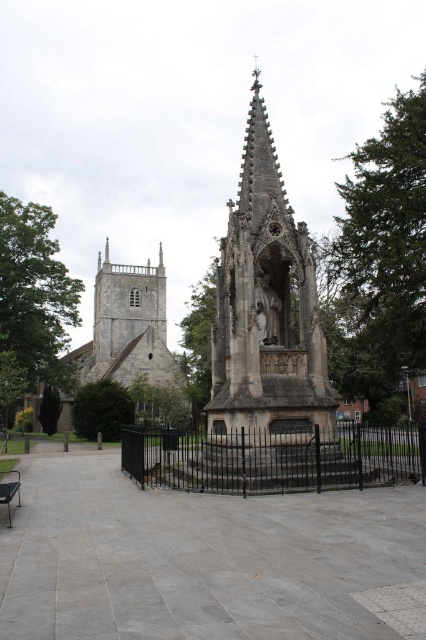
You are a visitor standing at the entrance of the churchyard and want to sit down to rest. You see the stone church at center and the black metal bench at lower left. Which object is larger and would provide a better reference for finding the bench?

The stone church at center is bigger than the black metal bench at lower left, so the stone church at center can be used as a larger reference point to locate the bench.

You are a visitor standing in front of the Gothic monument and want to rest. You see the black metal fence at center and the black metal bench at lower left. Which object is taller and can you sit on it?

The black metal fence at center is taller than the black metal bench at lower left. However, fences are typically not designed for sitting, so the bench would be the appropriate place to rest.